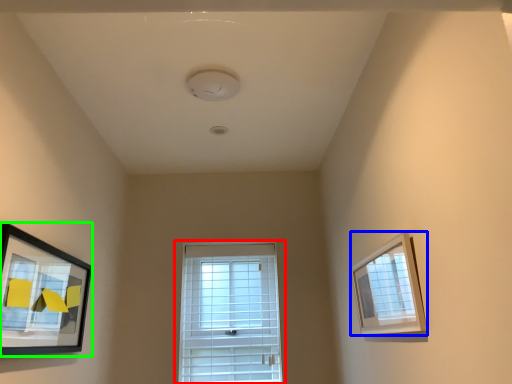
Question: Estimate the real-world distances between objects in this image. Which object is closer to window (highlighted by a red box), picture frame (highlighted by a blue box) or picture frame (highlighted by a green box)?

Choices:
 (A) picture frame
 (B) picture frame

Answer: (B)